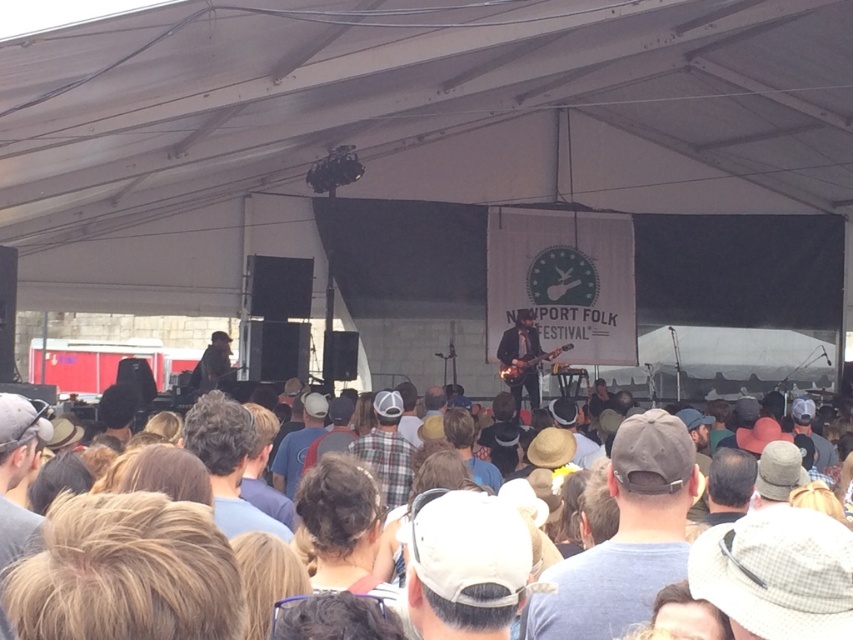
Can you confirm if dark brown hair at center is positioned to the left of plaid shirt at center?

Indeed, dark brown hair at center is positioned on the left side of plaid shirt at center.

Between dark brown hair at center and plaid shirt at center, which one is positioned lower?

plaid shirt at center is lower down.

Who is more distant from viewer, (x=212, y=401) or (x=376, y=433)?

Positioned behind is point (x=376, y=433).

Find the location of a particular element. The height and width of the screenshot is (640, 853). dark brown hair at center is located at coordinates (227, 461).

Does gray fabric cap at center come in front of dark brown hair at center?

That is True.

Image resolution: width=853 pixels, height=640 pixels. In order to click on gray fabric cap at center in this screenshot , I will do `click(625, 538)`.

Is gray fabric cap at center positioned in front of plaid shirt at center?

Yes, gray fabric cap at center is closer to the viewer.

Measure the distance from gray fabric cap at center to plaid shirt at center.

gray fabric cap at center and plaid shirt at center are 4.69 meters apart from each other.

Locate an element on the screen. gray fabric cap at center is located at coordinates (625, 538).